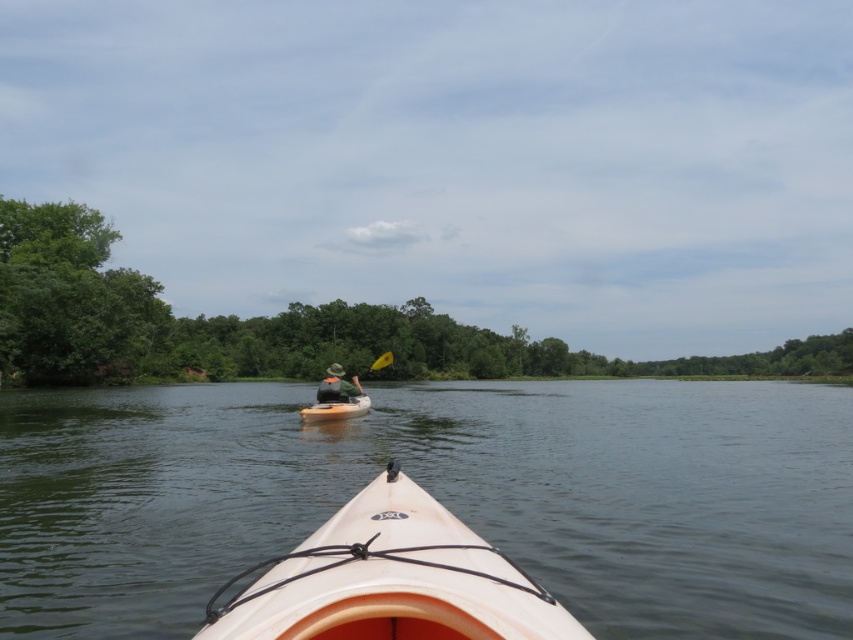
Which is more to the right, white plastic kayak at center or yellow foam paddle at center?

white plastic kayak at center is more to the right.

Who is lower down, white plastic kayak at center or yellow foam paddle at center?

Positioned lower is white plastic kayak at center.

Between point (437, 404) and point (380, 360), which one is positioned in front?

Positioned in front is point (380, 360).

Find the location of a particular element. This screenshot has height=640, width=853. white plastic kayak at center is located at coordinates (437, 497).

Which is more to the left, orange plastic canoe at center or yellow foam paddle at center?

yellow foam paddle at center

Describe the element at coordinates (335, 410) in the screenshot. I see `orange plastic canoe at center` at that location.

Who is more forward, [363,413] or [357,392]?

Point [357,392]

The height and width of the screenshot is (640, 853). Identify the location of orange plastic canoe at center. (335, 410).

Can you confirm if white matte kayak at center is wider than orange plastic canoe at center?

Yes.

Is the position of white matte kayak at center more distant than that of orange plastic canoe at center?

No, white matte kayak at center is closer to the viewer.

I want to click on white matte kayak at center, so click(x=390, y=580).